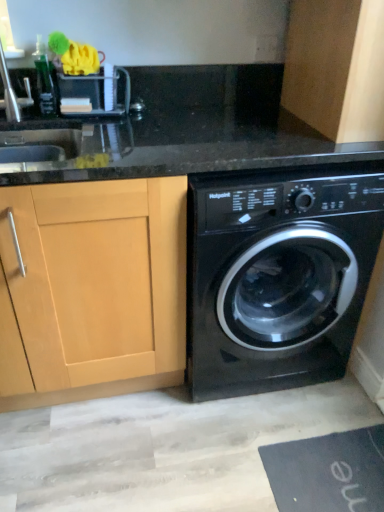
Measure the distance between point (278, 501) and camera.

Point (278, 501) is 4.04 feet from camera.

In order to face wooden cabinet at upper right, which is counted as the 2th cabinetry, starting from the left, should I rotate leftwards or rightwards?

A 20.075 degree turn to the right will do.

Find the location of a particular element. Image resolution: width=384 pixels, height=512 pixels. black glossy washing machine at lower right is located at coordinates (278, 275).

Image resolution: width=384 pixels, height=512 pixels. Describe the element at coordinates (93, 289) in the screenshot. I see `light wood cabinet at left, which appears as the 2th cabinetry when viewed from the top` at that location.

Locate an element on the screen. Image resolution: width=384 pixels, height=512 pixels. black rubber bath mat at lower right is located at coordinates (328, 472).

Would you say light wood cabinet at left, which appears as the 2th cabinetry when viewed from the top, is part of black rubber bath mat at lower right's contents?

No, light wood cabinet at left, which appears as the 2th cabinetry when viewed from the top, is not inside black rubber bath mat at lower right.

Considering the positions of objects black rubber bath mat at lower right and light wood cabinet at left, positioned as the 1th cabinetry in left-to-right order, in the image provided, who is more to the left, black rubber bath mat at lower right or light wood cabinet at left, positioned as the 1th cabinetry in left-to-right order,?

From the viewer's perspective, light wood cabinet at left, positioned as the 1th cabinetry in left-to-right order, appears more on the left side.

How many degrees apart are the facing directions of black rubber bath mat at lower right and light wood cabinet at left, positioned as the 1th cabinetry in left-to-right order?

The angular difference between black rubber bath mat at lower right and light wood cabinet at left, positioned as the 1th cabinetry in left-to-right order, is 90.1 degrees.

Image resolution: width=384 pixels, height=512 pixels. I want to click on bath mat on the right of light wood cabinet at left, the second cabinetry in the right-to-left sequence, so click(x=328, y=472).

Is point (109, 219) closer to camera compared to point (364, 448)?

Yes, it is in front of point (364, 448).

Is the position of light wood cabinet at left, the first cabinetry when ordered from bottom to top, less distant than that of black rubber bath mat at lower right?

That is True.

From a real-world perspective, which is physically above, light wood cabinet at left, which appears as the 2th cabinetry when viewed from the top, or black rubber bath mat at lower right?

From a 3D spatial view, light wood cabinet at left, which appears as the 2th cabinetry when viewed from the top, is above.

Who is smaller, black rubber bath mat at lower right or black glossy washing machine at lower right?

Smaller between the two is black rubber bath mat at lower right.

From the image's perspective, would you say black rubber bath mat at lower right is positioned over black glossy washing machine at lower right?

No, from the image's perspective, black rubber bath mat at lower right is not over black glossy washing machine at lower right.

Find the location of a particular element. washing machine in front of the black rubber bath mat at lower right is located at coordinates (278, 275).

Can you confirm if black rubber bath mat at lower right is shorter than black glossy washing machine at lower right?

Indeed, black rubber bath mat at lower right has a lesser height compared to black glossy washing machine at lower right.

Based on the photo, what's the angular difference between black glossy washing machine at lower right and wooden cabinet at upper right, acting as the first cabinetry starting from the top,'s facing directions?

The angle between the facing direction of black glossy washing machine at lower right and the facing direction of wooden cabinet at upper right, acting as the first cabinetry starting from the top, is 91.5 degrees.

Is black glossy washing machine at lower right in front of or behind wooden cabinet at upper right, marked as the 2th cabinetry in a bottom-to-top arrangement, in the image?

black glossy washing machine at lower right is positioned closer to the viewer than wooden cabinet at upper right, marked as the 2th cabinetry in a bottom-to-top arrangement.

How distant is black glossy washing machine at lower right from wooden cabinet at upper right, acting as the first cabinetry starting from the top?

The distance of black glossy washing machine at lower right from wooden cabinet at upper right, acting as the first cabinetry starting from the top, is 45.38 centimeters.

Can you confirm if black glossy washing machine at lower right is thinner than wooden cabinet at upper right, which is counted as the 2th cabinetry, starting from the left?

No, black glossy washing machine at lower right is not thinner than wooden cabinet at upper right, which is counted as the 2th cabinetry, starting from the left.

Which of these two, wooden cabinet at upper right, marked as the 2th cabinetry in a bottom-to-top arrangement, or black glossy washing machine at lower right, stands shorter?

wooden cabinet at upper right, marked as the 2th cabinetry in a bottom-to-top arrangement, is shorter.

Does wooden cabinet at upper right, acting as the first cabinetry starting from the top, turn towards black glossy washing machine at lower right?

No, wooden cabinet at upper right, acting as the first cabinetry starting from the top, is not facing towards black glossy washing machine at lower right.

Can you tell me how much wooden cabinet at upper right, marked as the 2th cabinetry in a bottom-to-top arrangement, and black glossy washing machine at lower right differ in facing direction?

The angular difference between wooden cabinet at upper right, marked as the 2th cabinetry in a bottom-to-top arrangement, and black glossy washing machine at lower right is 91.5 degrees.

Do you think wooden cabinet at upper right, which is counted as the 2th cabinetry, starting from the left, is within black glossy washing machine at lower right, or outside of it?

wooden cabinet at upper right, which is counted as the 2th cabinetry, starting from the left, is spatially situated outside black glossy washing machine at lower right.

From the image's perspective, is black glossy washing machine at lower right positioned above or below black rubber bath mat at lower right?

Clearly, from the image's perspective, black glossy washing machine at lower right is above black rubber bath mat at lower right.

How far apart are black glossy washing machine at lower right and black rubber bath mat at lower right?

The distance of black glossy washing machine at lower right from black rubber bath mat at lower right is 44.13 centimeters.

Between black glossy washing machine at lower right and black rubber bath mat at lower right, which one is positioned behind?

Positioned behind is black rubber bath mat at lower right.

Looking at the image, does black glossy washing machine at lower right seem bigger or smaller compared to black rubber bath mat at lower right?

Clearly, black glossy washing machine at lower right is larger in size than black rubber bath mat at lower right.

Is black glossy washing machine at lower right further to the viewer compared to light wood cabinet at left, the first cabinetry when ordered from bottom to top?

Yes.

From the image's perspective, is black glossy washing machine at lower right on light wood cabinet at left, positioned as the 1th cabinetry in left-to-right order?

Yes, from the image's perspective, black glossy washing machine at lower right is above light wood cabinet at left, positioned as the 1th cabinetry in left-to-right order.

Is black glossy washing machine at lower right far from light wood cabinet at left, the second cabinetry in the right-to-left sequence?

That's not correct — black glossy washing machine at lower right is a little close to light wood cabinet at left, the second cabinetry in the right-to-left sequence.

Between black glossy washing machine at lower right and light wood cabinet at left, positioned as the 1th cabinetry in left-to-right order, which one has smaller width?

Thinner between the two is light wood cabinet at left, positioned as the 1th cabinetry in left-to-right order.

From a real-world perspective, starting from the black rubber bath mat at lower right, which cabinetry is the 1st one vertically above it? Please provide its 2D coordinates.

[(93, 289)]

Where is `bath mat lying below the light wood cabinet at left, the second cabinetry in the right-to-left sequence (from the image's perspective)`? Image resolution: width=384 pixels, height=512 pixels. bath mat lying below the light wood cabinet at left, the second cabinetry in the right-to-left sequence (from the image's perspective) is located at coordinates (328, 472).

Looking at the image, which one is located closer to black glossy washing machine at lower right, wooden cabinet at upper right, which is counted as the 2th cabinetry, starting from the left, or black rubber bath mat at lower right?

black rubber bath mat at lower right is positioned closer to the anchor black glossy washing machine at lower right.

From the image, which object appears to be nearer to black rubber bath mat at lower right, light wood cabinet at left, the first cabinetry when ordered from bottom to top, or black glossy washing machine at lower right?

Based on the image, black glossy washing machine at lower right appears to be nearer to black rubber bath mat at lower right.

Which object lies further to the anchor point wooden cabinet at upper right, which is counted as the 2th cabinetry, starting from the left, light wood cabinet at left, positioned as the 1th cabinetry in left-to-right order, or black glossy washing machine at lower right?

light wood cabinet at left, positioned as the 1th cabinetry in left-to-right order, is positioned further to the anchor wooden cabinet at upper right, which is counted as the 2th cabinetry, starting from the left.

Based on their spatial positions, is wooden cabinet at upper right, which is counted as the 2th cabinetry, starting from the left, or light wood cabinet at left, which appears as the 2th cabinetry when viewed from the top, closer to black rubber bath mat at lower right?

Based on the image, light wood cabinet at left, which appears as the 2th cabinetry when viewed from the top, appears to be nearer to black rubber bath mat at lower right.

Looking at the image, which one is located closer to black glossy washing machine at lower right, black rubber bath mat at lower right or wooden cabinet at upper right, acting as the first cabinetry starting from the top?

black rubber bath mat at lower right.

Based on their spatial positions, is light wood cabinet at left, which appears as the 2th cabinetry when viewed from the top, or wooden cabinet at upper right, which is counted as the 2th cabinetry, starting from the left, closer to black rubber bath mat at lower right?

Based on the image, light wood cabinet at left, which appears as the 2th cabinetry when viewed from the top, appears to be nearer to black rubber bath mat at lower right.

Which object lies nearer to the anchor point black rubber bath mat at lower right, black glossy washing machine at lower right or wooden cabinet at upper right, positioned as the first cabinetry in right-to-left order?

black glossy washing machine at lower right is positioned closer to the anchor black rubber bath mat at lower right.

When comparing their distances from light wood cabinet at left, positioned as the 1th cabinetry in left-to-right order, does black glossy washing machine at lower right or wooden cabinet at upper right, positioned as the first cabinetry in right-to-left order, seem further?

Among the two, wooden cabinet at upper right, positioned as the first cabinetry in right-to-left order, is located further to light wood cabinet at left, positioned as the 1th cabinetry in left-to-right order.

The image size is (384, 512). Find the location of `cabinetry between wooden cabinet at upper right, marked as the 2th cabinetry in a bottom-to-top arrangement, and black rubber bath mat at lower right vertically`. cabinetry between wooden cabinet at upper right, marked as the 2th cabinetry in a bottom-to-top arrangement, and black rubber bath mat at lower right vertically is located at coordinates (93, 289).

This screenshot has width=384, height=512. In order to click on washing machine that lies between wooden cabinet at upper right, acting as the first cabinetry starting from the top, and black rubber bath mat at lower right from top to bottom in this screenshot , I will do `click(278, 275)`.

Locate an element on the screen. This screenshot has height=512, width=384. washing machine located between light wood cabinet at left, the second cabinetry in the right-to-left sequence, and wooden cabinet at upper right, acting as the first cabinetry starting from the top, in the left-right direction is located at coordinates (278, 275).

You are a GUI agent. You are given a task and a screenshot of the screen. Output one action in this format:
    pyautogui.click(x=<x>, y=<y>)
    Task: Click on the washing machine situated between light wood cabinet at left, the first cabinetry when ordered from bottom to top, and black rubber bath mat at lower right from left to right
    Image resolution: width=384 pixels, height=512 pixels.
    Given the screenshot: What is the action you would take?
    pyautogui.click(x=278, y=275)